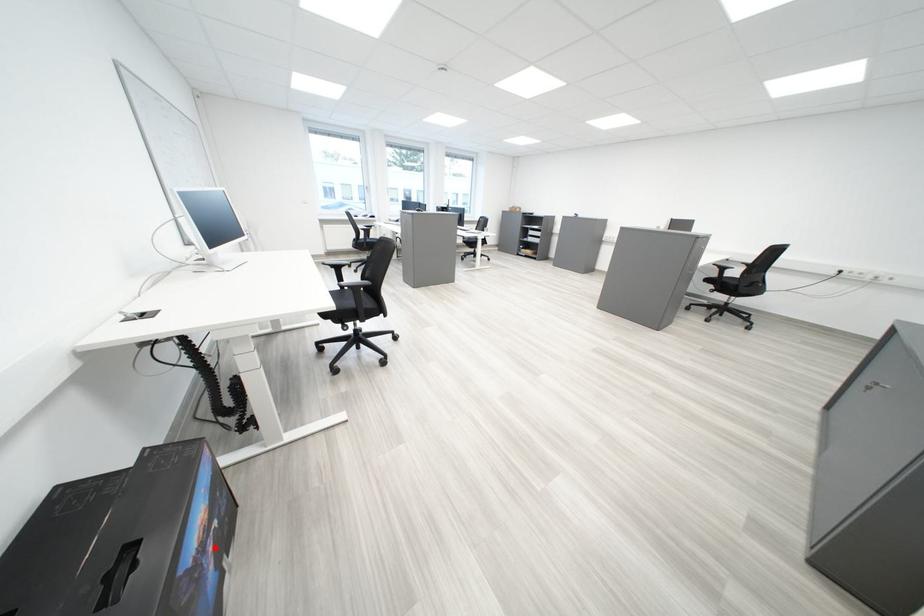
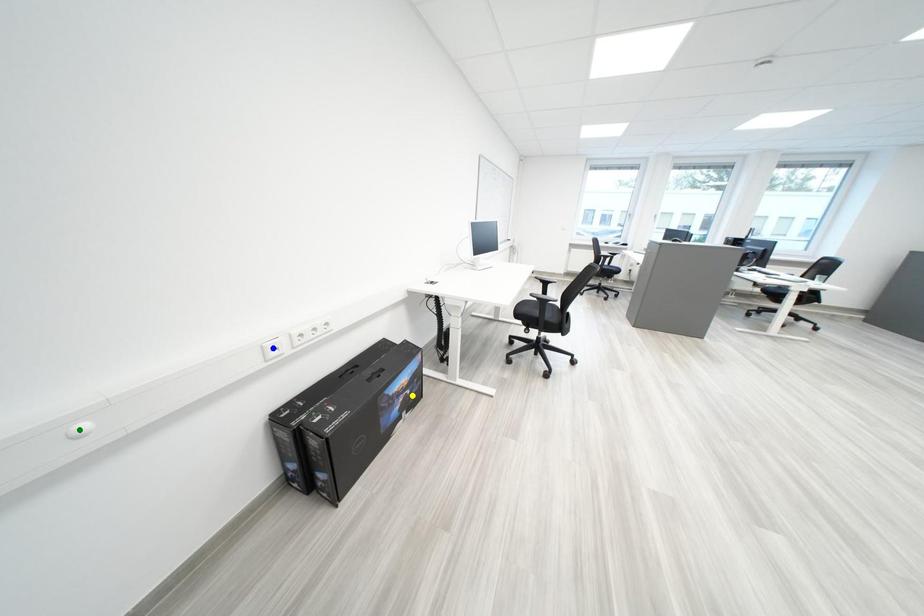
Question: I am providing you with two images of the same scene from different viewpoints. A red point is marked on the first image. You are given multiple points on the second image. Which point in image 2 represents the same 3d spot as the red point in image 1?

Choices:
 (A) blue point
 (B) yellow point
 (C) green point

Answer: (B)